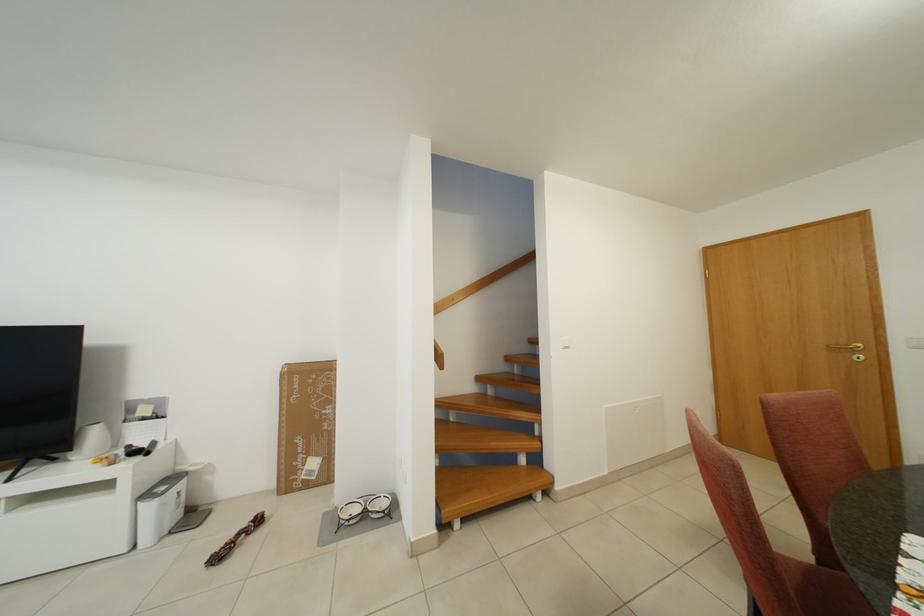
Where would you push the white light switch? Please return your answer as a coordinate pair (x, y).

(565, 342)